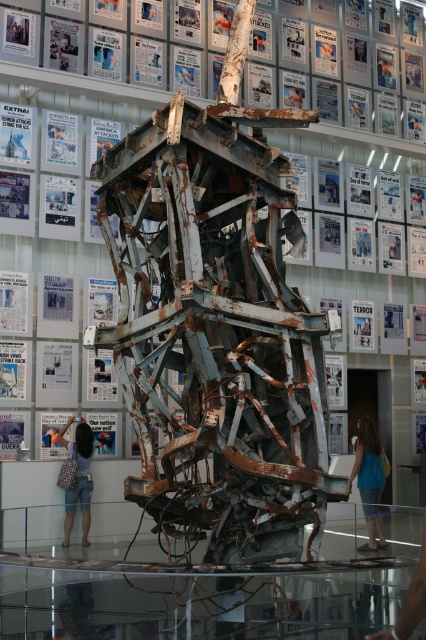
Question: Considering the real-world distances, which object is closest to the rusty metal sculpture at center?

Choices:
 (A) white glossy poster at upper center
 (B) white paper at upper left
 (C) blue denim shorts at lower left

Answer: (A)

Question: Is blue denim shorts at lower left smaller than white paper at upper left?

Choices:
 (A) no
 (B) yes

Answer: (A)

Question: Which of the following is the closest to the observer?

Choices:
 (A) blue denim shorts at lower left
 (B) white paper at upper left
 (C) blue denim jeans at lower right
 (D) white glossy poster at upper center

Answer: (C)

Question: Which point appears closest to the camera in this image?

Choices:
 (A) (17, 20)
 (B) (146, 3)
 (C) (416, 45)

Answer: (A)

Question: Does blue denim jeans at lower right have a greater width compared to white paper at upper left?

Choices:
 (A) no
 (B) yes

Answer: (B)

Question: Does blue denim shorts at lower left appear over white paper at upper left?

Choices:
 (A) yes
 (B) no

Answer: (B)